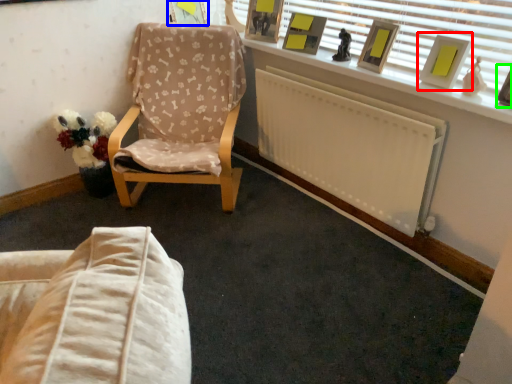
Question: Considering the real-world distances, which object is farthest from picture frame (highlighted by a red box)? picture frame (highlighted by a blue box) or picture frame (highlighted by a green box)?

Choices:
 (A) picture frame
 (B) picture frame

Answer: (A)